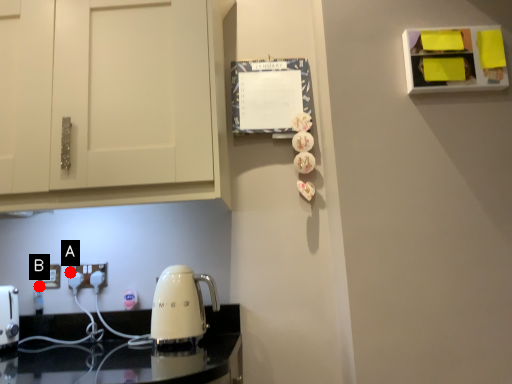
Question: Two points are circled on the image, labeled by A and B beside each circle. Among these points, which one is nearest to the camera?

Choices:
 (A) A is closer
 (B) B is closer

Answer: (A)